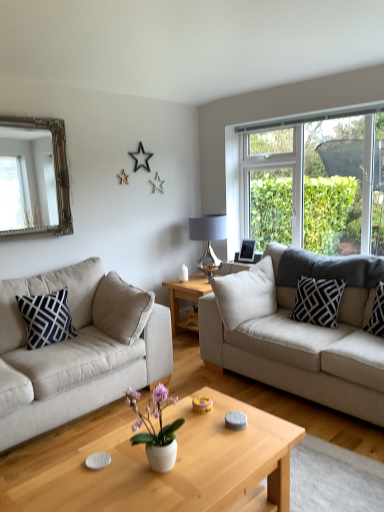
Image resolution: width=384 pixels, height=512 pixels. Describe the element at coordinates (247, 251) in the screenshot. I see `silver metallic picture frame at upper right` at that location.

Describe the element at coordinates (377, 313) in the screenshot. I see `black cotton pillow at right, placed as the 1th pillow when sorted from right to left` at that location.

What do you see at coordinates (78, 350) in the screenshot?
I see `beige fabric couch at left, arranged as the first studio couch when viewed from the left` at bounding box center [78, 350].

Identify the location of beige fabric couch at left, arranged as the 2th studio couch when viewed from the right. The width and height of the screenshot is (384, 512). (78, 350).

This screenshot has height=512, width=384. In order to click on silver/gilded mirror at upper left in this screenshot , I will do `click(54, 165)`.

The width and height of the screenshot is (384, 512). Describe the element at coordinates (308, 182) in the screenshot. I see `clear glass window at right` at that location.

In order to click on light wood coffee table at center, which is counted as the 1th coffee table, starting from the bottom in this screenshot , I will do `click(166, 473)`.

From a real-world perspective, who is located lower, beige fabric couch at right, which is the first studio couch from right to left, or beige fabric couch at left, arranged as the 2th studio couch when viewed from the right?

beige fabric couch at left, arranged as the 2th studio couch when viewed from the right, is physically lower.

How different are the orientations of beige fabric couch at right, which is the second studio couch in left-to-right order, and beige fabric couch at left, arranged as the first studio couch when viewed from the left, in degrees?

beige fabric couch at right, which is the second studio couch in left-to-right order, and beige fabric couch at left, arranged as the first studio couch when viewed from the left, are facing 89.6 degrees away from each other.

Looking at this image, from the image's perspective, does beige fabric couch at right, which is the first studio couch from right to left, appear lower than beige fabric couch at left, arranged as the 2th studio couch when viewed from the right?

No, from the image's perspective, beige fabric couch at right, which is the first studio couch from right to left, is not beneath beige fabric couch at left, arranged as the 2th studio couch when viewed from the right.

Looking at this image, which object is closer to the camera taking this photo, beige fabric couch at right, which is the second studio couch in left-to-right order, or beige fabric couch at left, arranged as the 2th studio couch when viewed from the right?

beige fabric couch at left, arranged as the 2th studio couch when viewed from the right, is in front.

Which pillow is the 3rd one when counting from the right side of the silver/gilded mirror at upper left? Please provide its 2D coordinates.

[(377, 313)]

In the image, is black cotton pillow at right, the third pillow positioned from the left, positioned in front of or behind silver/gilded mirror at upper left?

black cotton pillow at right, the third pillow positioned from the left, is in front of silver/gilded mirror at upper left.

Based on their positions, is black cotton pillow at right, the third pillow positioned from the left, located to the left or right of silver/gilded mirror at upper left?

In the image, black cotton pillow at right, the third pillow positioned from the left, appears on the right side of silver/gilded mirror at upper left.

Which object is closer to the camera taking this photo, white ceramic pot at center or metallic silver lamp at center?

white ceramic pot at center is closer to the camera.

The height and width of the screenshot is (512, 384). In order to click on houseplant below the metallic silver lamp at center (from a real-world perspective) in this screenshot , I will do `click(154, 429)`.

Based on the photo, is white ceramic pot at center inside the boundaries of metallic silver lamp at center, or outside?

white ceramic pot at center is outside metallic silver lamp at center.

Considering the relative sizes of navy blue/white geometric pillow at left, the first pillow when ordered from left to right, and black cotton pillow at right, placed as the 1th pillow when sorted from right to left, in the image provided, is navy blue/white geometric pillow at left, the first pillow when ordered from left to right, thinner than black cotton pillow at right, placed as the 1th pillow when sorted from right to left,?

Indeed, navy blue/white geometric pillow at left, the first pillow when ordered from left to right, has a lesser width compared to black cotton pillow at right, placed as the 1th pillow when sorted from right to left.

Consider the image. Does navy blue/white geometric pillow at left, which is the third pillow in right-to-left order, have a lesser height compared to black cotton pillow at right, the third pillow positioned from the left?

In fact, navy blue/white geometric pillow at left, which is the third pillow in right-to-left order, may be taller than black cotton pillow at right, the third pillow positioned from the left.

Could you tell me if navy blue/white geometric pillow at left, the first pillow when ordered from left to right, is facing black cotton pillow at right, placed as the 1th pillow when sorted from right to left?

No, navy blue/white geometric pillow at left, the first pillow when ordered from left to right, is not aimed at black cotton pillow at right, placed as the 1th pillow when sorted from right to left.

How many degrees apart are the facing directions of navy blue/white geometric pillow at left, which is the third pillow in right-to-left order, and black cotton pillow at right, the third pillow positioned from the left?

89.6 degrees.

From the picture: Considering the relative positions of silver metallic picture frame at upper right and silver/gilded mirror at upper left in the image provided, is silver metallic picture frame at upper right to the right of silver/gilded mirror at upper left from the viewer's perspective?

Yes, silver metallic picture frame at upper right is to the right of silver/gilded mirror at upper left.

Would you say silver metallic picture frame at upper right is a long distance from silver/gilded mirror at upper left?

silver metallic picture frame at upper right is far away from silver/gilded mirror at upper left.

From the image's perspective, is silver metallic picture frame at upper right located above silver/gilded mirror at upper left?

Actually, silver metallic picture frame at upper right appears below silver/gilded mirror at upper left in the image.

Is silver metallic picture frame at upper right completely or partially outside of silver/gilded mirror at upper left?

silver metallic picture frame at upper right is positioned outside silver/gilded mirror at upper left.

Looking at their sizes, would you say navy blue/white geometric pillow at left, which is the third pillow in right-to-left order, is wider or thinner than clear glass window at right?

Clearly, navy blue/white geometric pillow at left, which is the third pillow in right-to-left order, has more width compared to clear glass window at right.

Between navy blue/white geometric pillow at left, which is the third pillow in right-to-left order, and clear glass window at right, which one has smaller size?

navy blue/white geometric pillow at left, which is the third pillow in right-to-left order, is smaller.

Is black cotton pillow at right, placed as the 1th pillow when sorted from right to left, next to beige fabric couch at left, arranged as the first studio couch when viewed from the left?

No, black cotton pillow at right, placed as the 1th pillow when sorted from right to left, is not touching beige fabric couch at left, arranged as the first studio couch when viewed from the left.

Where is `the 1st pillow behind the beige fabric couch at left, arranged as the first studio couch when viewed from the left`? Image resolution: width=384 pixels, height=512 pixels. the 1st pillow behind the beige fabric couch at left, arranged as the first studio couch when viewed from the left is located at coordinates (377, 313).

Is black cotton pillow at right, placed as the 1th pillow when sorted from right to left, located outside beige fabric couch at left, arranged as the 2th studio couch when viewed from the right?

Yes, black cotton pillow at right, placed as the 1th pillow when sorted from right to left, is outside of beige fabric couch at left, arranged as the 2th studio couch when viewed from the right.

Find the location of `studio couch above the beige fabric couch at left, arranged as the first studio couch when viewed from the left (from a real-world perspective)`. studio couch above the beige fabric couch at left, arranged as the first studio couch when viewed from the left (from a real-world perspective) is located at coordinates (304, 352).

At what (x,y) coordinates should I click in order to perform the action: click on mirror that is on the left side of black cotton pillow at right, placed as the 1th pillow when sorted from right to left. Please return your answer as a coordinate pair (x, y). The width and height of the screenshot is (384, 512). Looking at the image, I should click on (54, 165).

Looking at the image, which one is located further to beige fabric couch at right, which is the first studio couch from right to left, black and white patterned pillow at right, which appears as the second pillow when viewed from the left, or navy blue/white geometric pillow at left, the first pillow when ordered from left to right?

navy blue/white geometric pillow at left, the first pillow when ordered from left to right.

When comparing their distances from silver metallic picture frame at upper right, does wooden coffee table at center, which is counted as the second coffee table, starting from the front, or beige fabric couch at right, which is the first studio couch from right to left, seem closer?

wooden coffee table at center, which is counted as the second coffee table, starting from the front.

Estimate the real-world distances between objects in this image. Which object is closer to navy blue/white geometric pillow at left, the first pillow when ordered from left to right, beige fabric couch at left, arranged as the 2th studio couch when viewed from the right, or silver/gilded mirror at upper left?

beige fabric couch at left, arranged as the 2th studio couch when viewed from the right, is positioned closer to the anchor navy blue/white geometric pillow at left, the first pillow when ordered from left to right.

Which object lies further to the anchor point silver metallic picture frame at upper right, silver/gilded mirror at upper left or beige fabric couch at left, arranged as the first studio couch when viewed from the left?

Based on the image, silver/gilded mirror at upper left appears to be further to silver metallic picture frame at upper right.

Based on their spatial positions, is navy blue/white geometric pillow at left, the first pillow when ordered from left to right, or light wood coffee table at center, which is counted as the 1th coffee table, starting from the bottom, closer to beige fabric couch at right, which is the first studio couch from right to left?

Among the two, light wood coffee table at center, which is counted as the 1th coffee table, starting from the bottom, is located nearer to beige fabric couch at right, which is the first studio couch from right to left.

Estimate the real-world distances between objects in this image. Which object is closer to clear glass window at right, white ceramic pot at center or black cotton pillow at right, placed as the 1th pillow when sorted from right to left?

black cotton pillow at right, placed as the 1th pillow when sorted from right to left, is positioned closer to the anchor clear glass window at right.

Estimate the real-world distances between objects in this image. Which object is closer to silver metallic picture frame at upper right, metallic silver lamp at center or black and white patterned pillow at right, the 2th pillow viewed from the right?

metallic silver lamp at center is closer to silver metallic picture frame at upper right.

Based on their spatial positions, is light wood coffee table at center, which is counted as the 1th coffee table, starting from the bottom, or clear glass window at right further from white ceramic pot at center?

clear glass window at right is further to white ceramic pot at center.

Locate an element on the screen. mirror between white ceramic pot at center and wooden coffee table at center, positioned as the second coffee table in bottom-to-top order, from front to back is located at coordinates (54, 165).

Where is `pillow between navy blue/white geometric pillow at left, the first pillow when ordered from left to right, and black cotton pillow at right, the third pillow positioned from the left, in the horizontal direction`? This screenshot has height=512, width=384. pillow between navy blue/white geometric pillow at left, the first pillow when ordered from left to right, and black cotton pillow at right, the third pillow positioned from the left, in the horizontal direction is located at coordinates (318, 301).

Where is `studio couch between silver/gilded mirror at upper left and beige fabric couch at right, which is the second studio couch in left-to-right order, in the horizontal direction`? studio couch between silver/gilded mirror at upper left and beige fabric couch at right, which is the second studio couch in left-to-right order, in the horizontal direction is located at coordinates (78, 350).

Find the location of a particular element. The image size is (384, 512). houseplant between light wood coffee table at center, which is the 2th coffee table in back-to-front order, and wooden coffee table at center, arranged as the first coffee table when viewed from the top, from front to back is located at coordinates (154, 429).